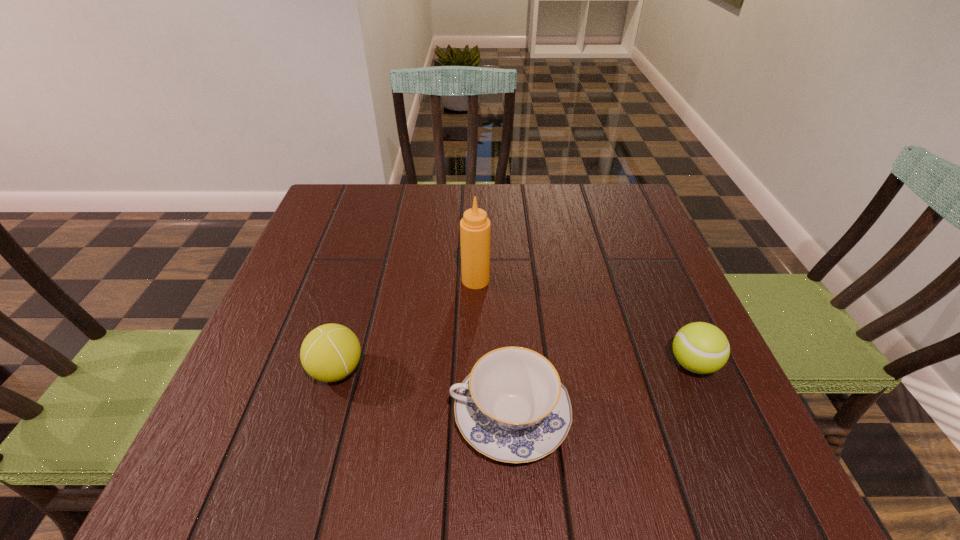
The height and width of the screenshot is (540, 960). What are the coordinates of `the tallest object` in the screenshot? It's located at (475, 227).

Where is `the farthest object`? The image size is (960, 540). the farthest object is located at coordinates (475, 227).

The width and height of the screenshot is (960, 540). I want to click on the leftmost object, so click(x=330, y=352).

You are a GUI agent. You are given a task and a screenshot of the screen. Output one action in this format:
    pyautogui.click(x=<x>, y=<y>)
    Task: Click on the chinaware
    The image size is (960, 540).
    Given the screenshot: What is the action you would take?
    pyautogui.click(x=512, y=407)

Locate an element on the screen. the right tennis ball is located at coordinates (702, 348).

You are a GUI agent. You are given a task and a screenshot of the screen. Output one action in this format:
    pyautogui.click(x=<x>, y=<y>)
    Task: Click on the blank space located on the right of the tallest object
    The image size is (960, 540).
    Given the screenshot: What is the action you would take?
    pyautogui.click(x=578, y=280)

At what (x,y) coordinates should I click in order to perform the action: click on vacant space situated on the back of the leftmost object. Please return your answer as a coordinate pair (x, y). This screenshot has height=540, width=960. Looking at the image, I should click on (358, 298).

At what (x,y) coordinates should I click in order to perform the action: click on vacant space located with the handle on the side of the chinaware. Please return your answer as a coordinate pair (x, y). The height and width of the screenshot is (540, 960). Looking at the image, I should click on (380, 415).

Locate an element on the screen. free space located with the handle on the side of the chinaware is located at coordinates (362, 415).

The height and width of the screenshot is (540, 960). I want to click on free space located 0.270m with the handle on the side of the chinaware, so click(291, 415).